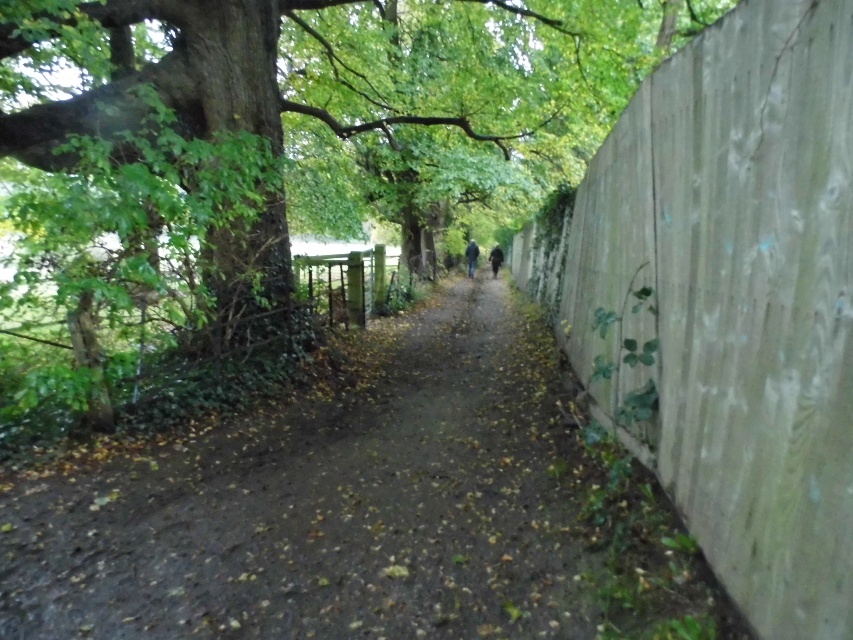
You are a hiker navigating the path and notice the green leafy tree at upper left and the dark blue fabric at center. Which object is positioned more to the left side of the path?

The green leafy tree at upper left is positioned more to the left side of the path than the dark blue fabric at center.

Consider the image. You are standing at the entrance of the pathway and want to take a photo of the green leafy tree at upper left. According to the scene description, where should you position yourself to capture it in the frame?

To capture the green leafy tree at upper left in the frame, position yourself at the entrance of the pathway since the tree is located at point (331, 108), which is near the upper left corner of the scene.